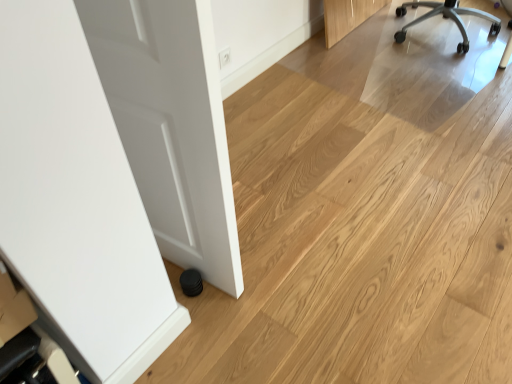
This screenshot has width=512, height=384. What are the coordinates of `free space in front of silver metallic chair at upper right` in the screenshot? It's located at (445, 82).